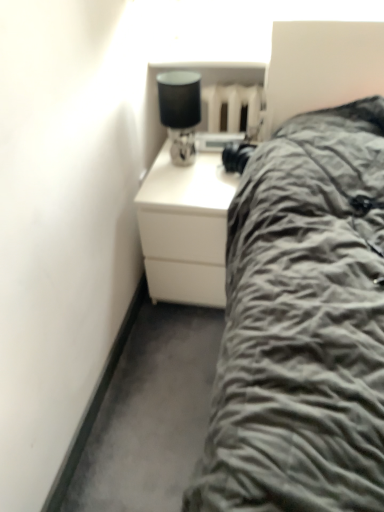
Question: Is matte black lampshade at upper right at the right side of white matte chest of drawers at center?

Choices:
 (A) yes
 (B) no

Answer: (B)

Question: Could you tell me if matte black lampshade at upper right is turned towards white matte chest of drawers at center?

Choices:
 (A) yes
 (B) no

Answer: (B)

Question: Is matte black lampshade at upper right turned away from white matte chest of drawers at center?

Choices:
 (A) no
 (B) yes

Answer: (A)

Question: Is matte black lampshade at upper right at the left side of white matte chest of drawers at center?

Choices:
 (A) no
 (B) yes

Answer: (B)

Question: Is matte black lampshade at upper right far from white matte chest of drawers at center?

Choices:
 (A) yes
 (B) no

Answer: (B)

Question: Can white matte chest of drawers at center be found inside matte black lampshade at upper right?

Choices:
 (A) no
 (B) yes

Answer: (A)

Question: Is white matte chest of drawers at center thinner than matte black lampshade at upper right?

Choices:
 (A) no
 (B) yes

Answer: (A)

Question: Is white matte chest of drawers at center wider than matte black lampshade at upper right?

Choices:
 (A) yes
 (B) no

Answer: (A)

Question: Can you confirm if white matte chest of drawers at center is smaller than matte black lampshade at upper right?

Choices:
 (A) yes
 (B) no

Answer: (B)

Question: Is the position of white matte chest of drawers at center more distant than that of matte black lampshade at upper right?

Choices:
 (A) no
 (B) yes

Answer: (B)

Question: Is white matte chest of drawers at center positioned beyond the bounds of matte black lampshade at upper right?

Choices:
 (A) no
 (B) yes

Answer: (B)

Question: Is white matte chest of drawers at center to the right of matte black lampshade at upper right from the viewer's perspective?

Choices:
 (A) yes
 (B) no

Answer: (A)

Question: In terms of width, does white matte chest of drawers at center look wider or thinner when compared to matte black lampshade at upper right?

Choices:
 (A) thin
 (B) wide

Answer: (B)